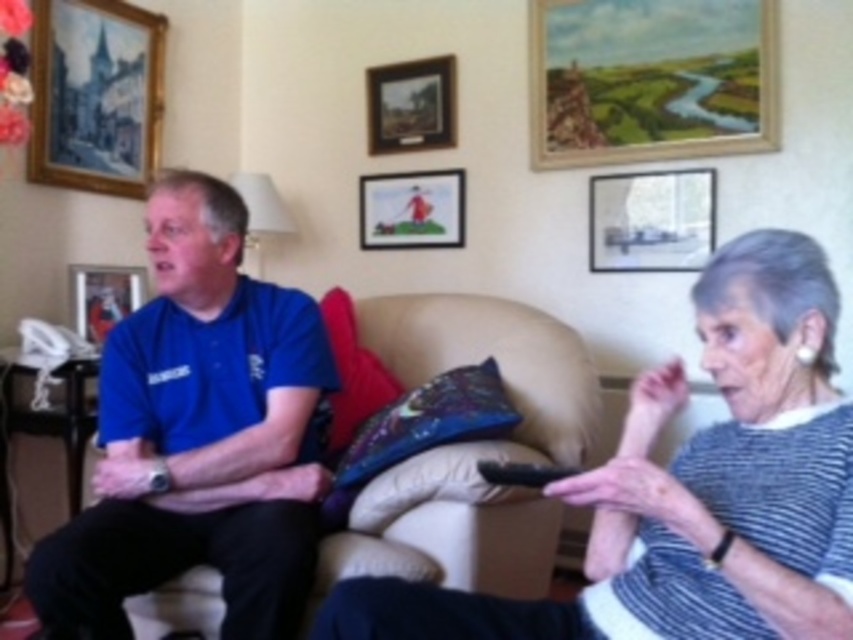
Question: In this image, where is beige fabric couch at center located relative to matte plastic picture frame at upper center?

Choices:
 (A) above
 (B) below

Answer: (B)

Question: Which object is positioned farthest from the matte wooden picture frame at upper right?

Choices:
 (A) wooden picture frame at left
 (B) beige fabric couch at center
 (C) blue cotton shirt at left
 (D) wooden framed landscape painting at upper center

Answer: (A)

Question: Which object is positioned farthest from the wooden framed landscape painting at upper center?

Choices:
 (A) beige fabric couch at center
 (B) matte wooden picture frame at upper left
 (C) wooden picture frame at left

Answer: (C)

Question: Does blue cotton shirt at left appear under velvet-like blue pillow at center?

Choices:
 (A) yes
 (B) no

Answer: (B)

Question: Which point appears farthest from the camera in this image?

Choices:
 (A) (532, 141)
 (B) (653, 230)

Answer: (A)

Question: Can you confirm if wooden framed picture at center is wider than wooden picture frame at left?

Choices:
 (A) yes
 (B) no

Answer: (A)